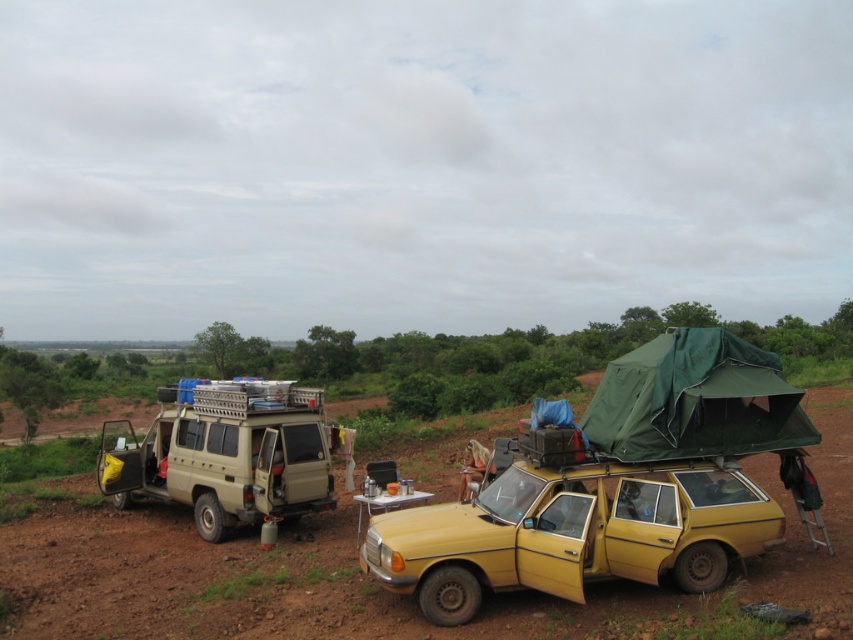
Question: Which point is farther to the camera?

Choices:
 (A) brown dirt track at lower left
 (B) beige matte van at left
 (C) green fabric tent at upper right

Answer: (B)

Question: Among these points, which one is nearest to the camera?

Choices:
 (A) (491, 618)
 (B) (268, 397)

Answer: (A)

Question: Can you confirm if yellow matte car at center is positioned below beige matte van at left?

Choices:
 (A) yes
 (B) no

Answer: (B)

Question: From the image, what is the correct spatial relationship of brown dirt track at lower left in relation to green fabric tent at upper right?

Choices:
 (A) right
 (B) left

Answer: (A)

Question: Among these objects, which one is farthest from the camera?

Choices:
 (A) brown dirt track at lower left
 (B) yellow matte car at center
 (C) green fabric tent at upper right
 (D) beige matte van at left

Answer: (D)

Question: Can you confirm if brown dirt track at lower left is smaller than green fabric tent at upper right?

Choices:
 (A) no
 (B) yes

Answer: (A)